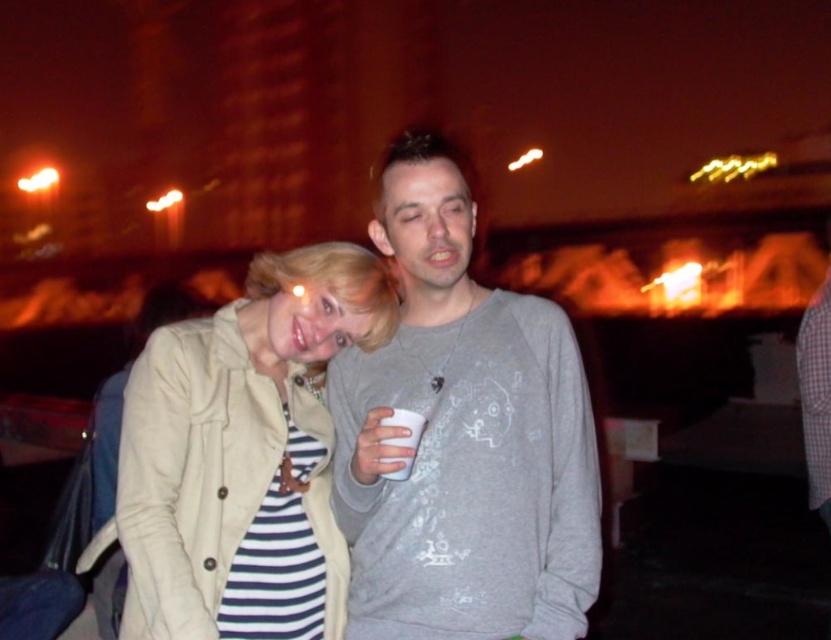
Which is more to the right, beige fabric jacket at center or white paper cup at center?

white paper cup at center

Between beige fabric jacket at center and white paper cup at center, which one appears on the left side from the viewer's perspective?

Positioned to the left is beige fabric jacket at center.

Locate an element on the screen. This screenshot has width=831, height=640. beige fabric jacket at center is located at coordinates (244, 454).

You are a GUI agent. You are given a task and a screenshot of the screen. Output one action in this format:
    pyautogui.click(x=<x>, y=<y>)
    Task: Click on the beige fabric jacket at center
    The height and width of the screenshot is (640, 831).
    Given the screenshot: What is the action you would take?
    pyautogui.click(x=244, y=454)

Is gray cotton sweatshirt at center further to camera compared to beige fabric jacket at center?

Answer: No, it is in front of beige fabric jacket at center.

How much distance is there between gray cotton sweatshirt at center and beige fabric jacket at center?

gray cotton sweatshirt at center is 10.77 inches from beige fabric jacket at center.

Is point (366, 355) positioned in front of point (323, 291)?

No, (366, 355) is further to viewer.

Where is `gray cotton sweatshirt at center`? This screenshot has width=831, height=640. gray cotton sweatshirt at center is located at coordinates (463, 436).

Between gray cotton sweatshirt at center and white paper cup at center, which one is positioned higher?

gray cotton sweatshirt at center is above.

Is point (497, 504) positioned after point (392, 436)?

Yes, it is.

Where is `gray cotton sweatshirt at center`? The width and height of the screenshot is (831, 640). gray cotton sweatshirt at center is located at coordinates (463, 436).